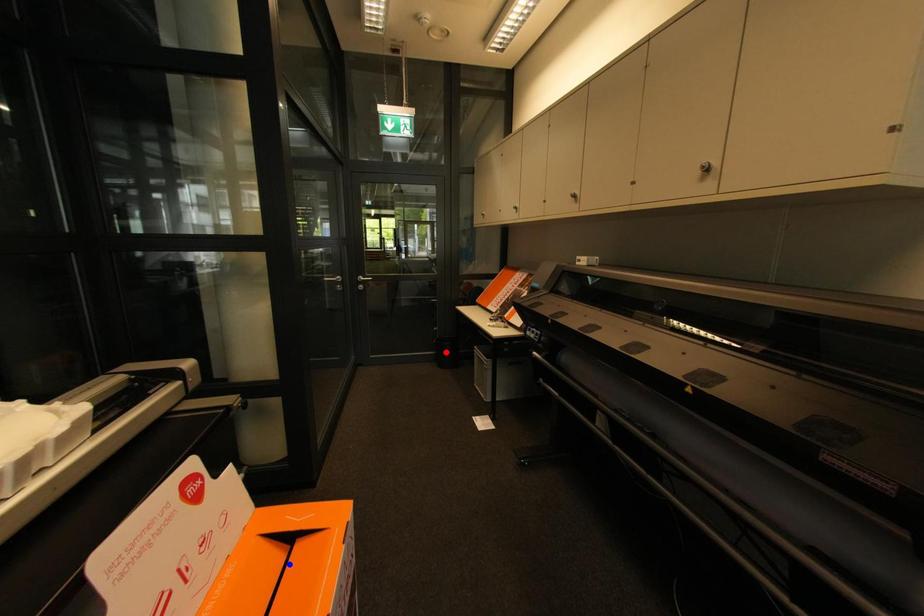
Question: Which of the two points in the image is closer to the camera?

Choices:
 (A) Blue point is closer.
 (B) Red point is closer.

Answer: (A)